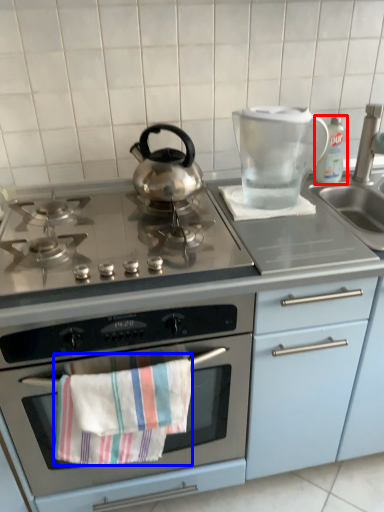
Question: Which point is closer to the camera, bottle (highlighted by a red box) or beach towel (highlighted by a blue box)?

Choices:
 (A) bottle
 (B) beach towel

Answer: (B)